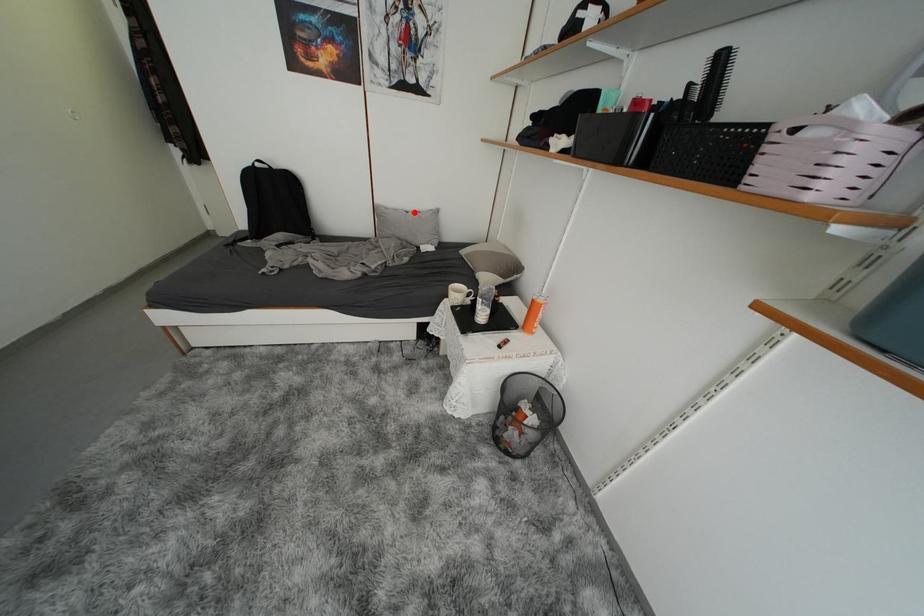
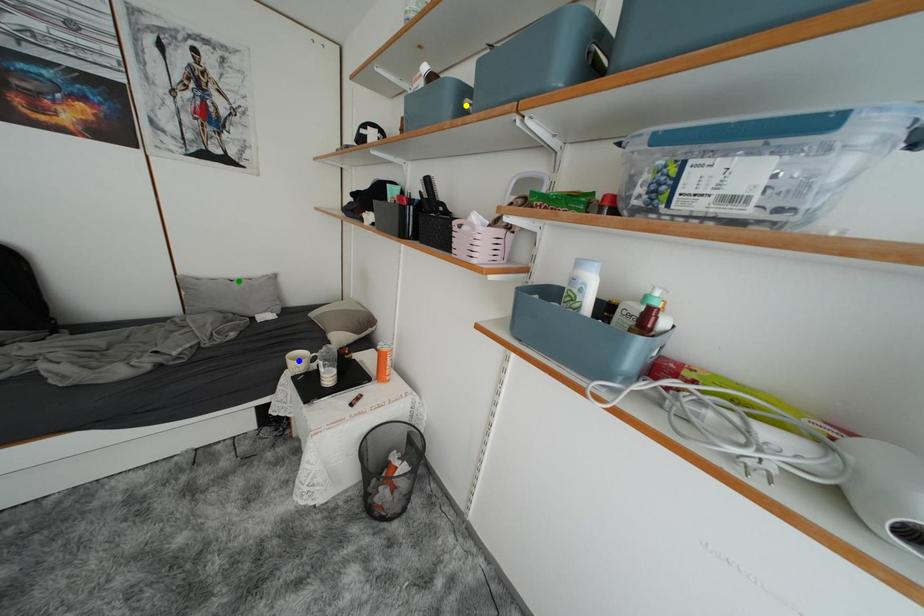
Question: I am providing you with two images of the same scene from different viewpoints. A red point is marked on the first image. You are given multiple points on the second image. Which point in image 2 is actually the same real-world point as the red point in image 1?

Choices:
 (A) yellow point
 (B) blue point
 (C) green point

Answer: (C)